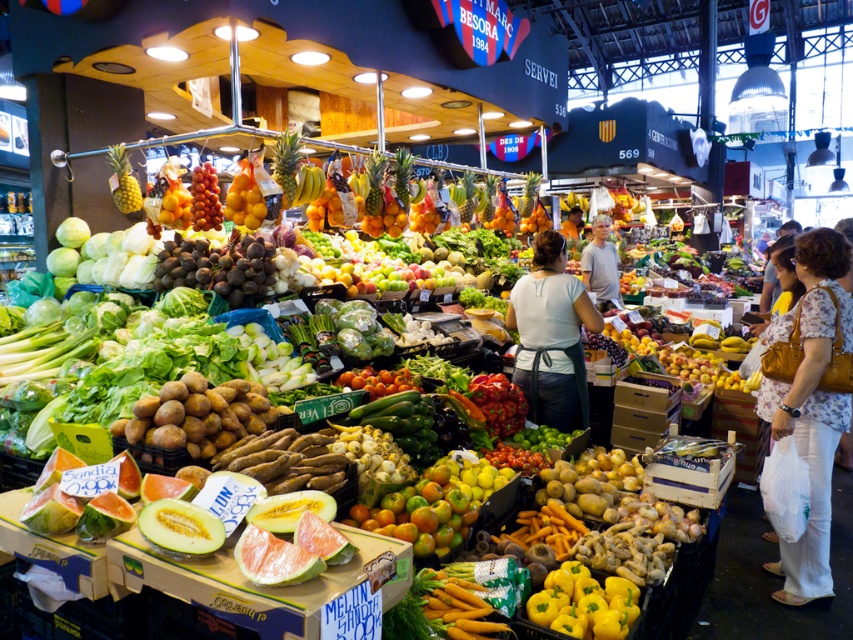
Is white fabric apron at center smaller than smooth white shirt at center?

Incorrect, white fabric apron at center is not smaller in size than smooth white shirt at center.

Is white fabric apron at center wider than smooth white shirt at center?

Yes.

Where is `white fabric apron at center`? The height and width of the screenshot is (640, 853). white fabric apron at center is located at coordinates (550, 337).

Between point (567, 328) and point (254, 188), which one is positioned in front?

Point (254, 188) is more forward.

Is white fabric apron at center above yellow glossy grapes at center?

No, white fabric apron at center is not above yellow glossy grapes at center.

Where is `white fabric apron at center`? The image size is (853, 640). white fabric apron at center is located at coordinates (550, 337).

From the picture: Who is shorter, yellow matte bell pepper at center or yellow glossy grapes at center?

yellow matte bell pepper at center

Can you confirm if yellow matte bell pepper at center is positioned to the right of yellow glossy grapes at center?

Indeed, yellow matte bell pepper at center is positioned on the right side of yellow glossy grapes at center.

Is point (613, 627) more distant than point (236, 216)?

No, (613, 627) is closer to viewer.

The width and height of the screenshot is (853, 640). Identify the location of yellow matte bell pepper at center. (584, 604).